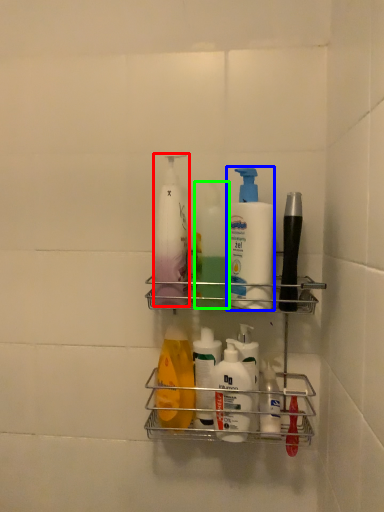
Question: Which is nearer to the cleaning product (highlighted by a red box)? cleaning product (highlighted by a blue box) or cleaning product (highlighted by a green box).

Choices:
 (A) cleaning product
 (B) cleaning product

Answer: (B)